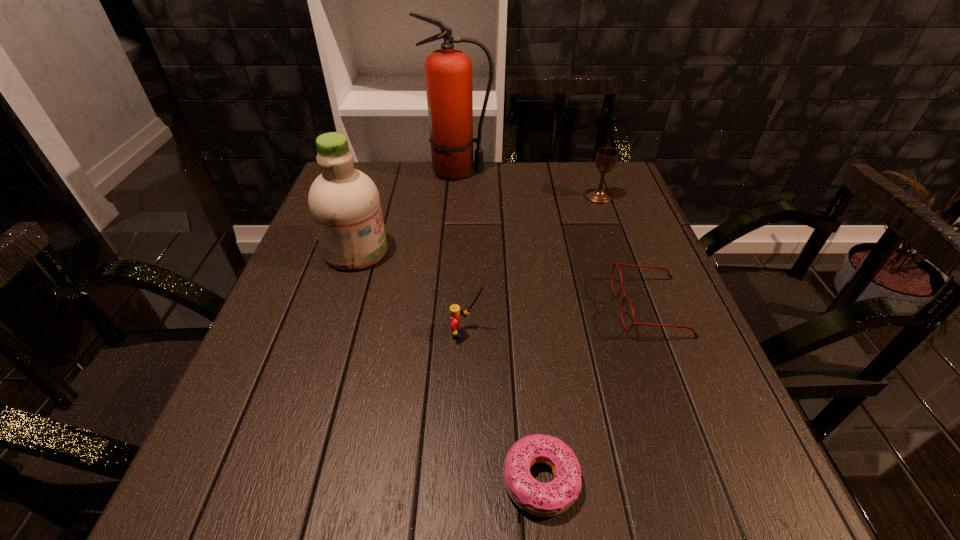
The width and height of the screenshot is (960, 540). Identify the location of fire extinguisher. (448, 72).

This screenshot has width=960, height=540. I want to click on the tallest object, so click(448, 72).

Find the location of `the second tallest object`. the second tallest object is located at coordinates (344, 202).

Locate an element on the screen. Image resolution: width=960 pixels, height=540 pixels. cleansing agent is located at coordinates (344, 202).

The image size is (960, 540). In order to click on the fourth shortest object in this screenshot , I will do `click(606, 158)`.

Where is `chalice`? chalice is located at coordinates (606, 158).

Find the location of a particular element. This screenshot has width=960, height=540. Lego is located at coordinates (455, 311).

The width and height of the screenshot is (960, 540). Identify the location of the fifth tallest object. (617, 264).

The width and height of the screenshot is (960, 540). In order to click on the shortest object in this screenshot , I will do `click(541, 499)`.

Where is `the nearest object`? The height and width of the screenshot is (540, 960). the nearest object is located at coordinates (541, 499).